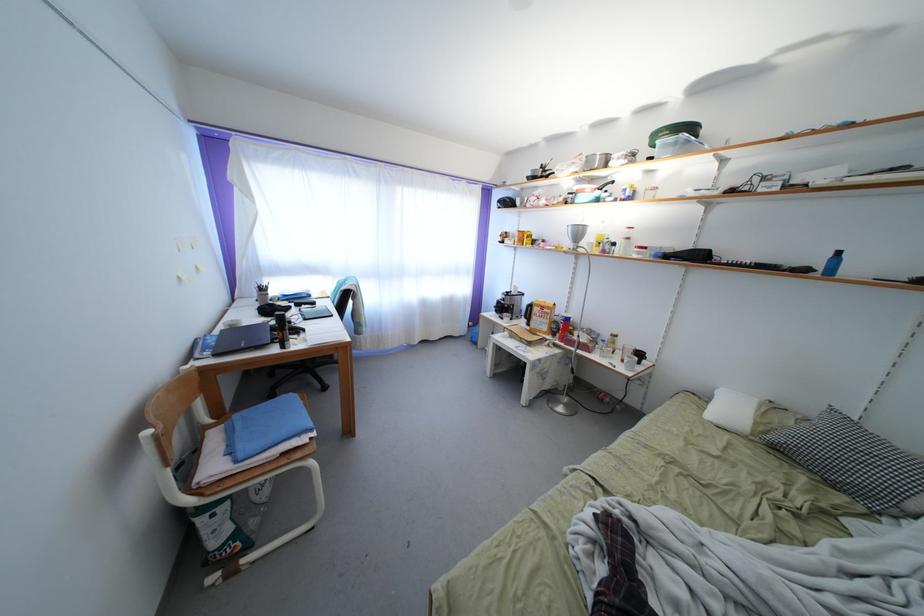
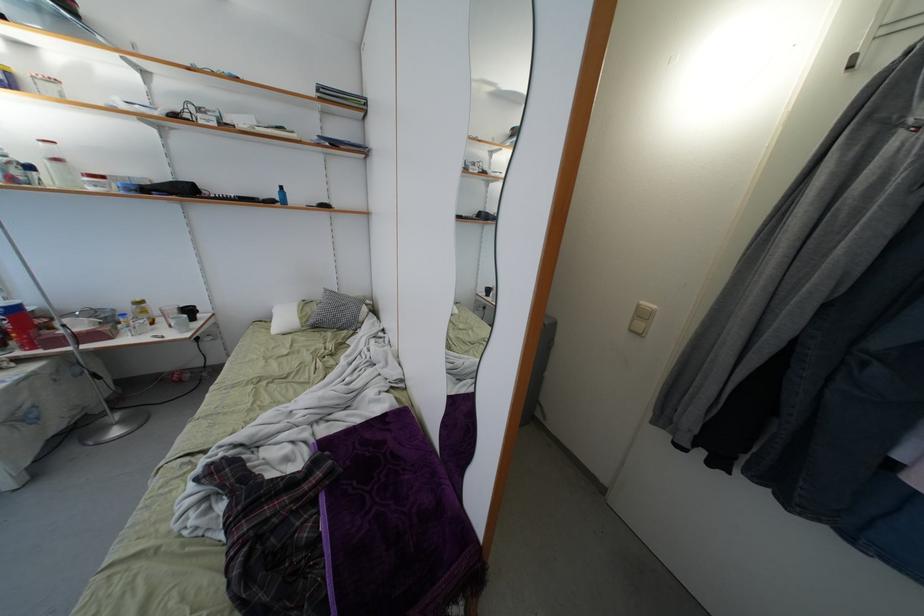
In the second image, find the point that corresponds to (x=708, y=415) in the first image.

(274, 334)